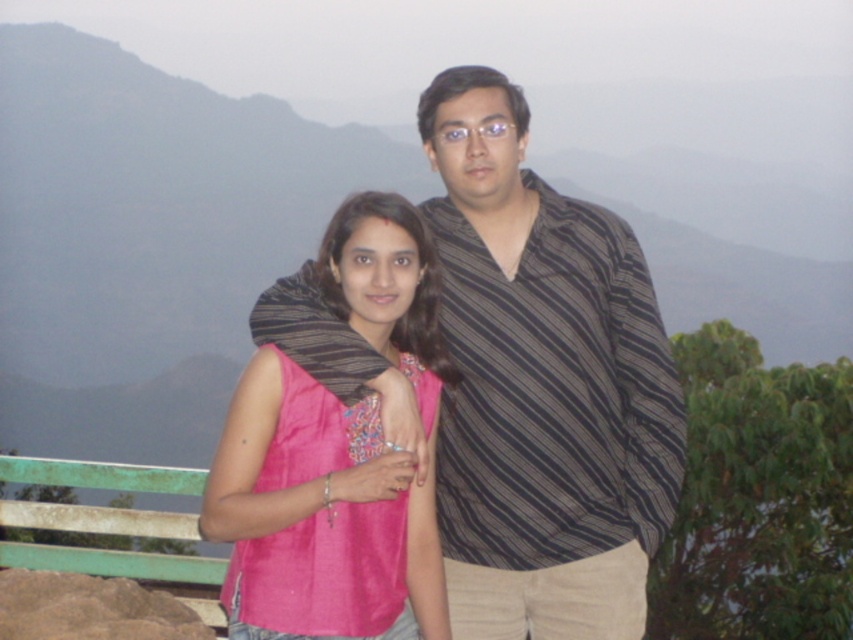
You are a photographer adjusting your camera settings. You notice the striped fabric shirt at center in the image. Where exactly is this shirt positioned in terms of coordinates?

The striped fabric shirt at center is located at point coordinates [543,387].

You are a photographer adjusting your camera settings to focus on two specific points in the image. The points are labeled as point (444, 460) and point (381, 540). Which of these points is closer to the camera?

Point (444, 460) is further to the camera than point (381, 540), so the point closer to the camera is point (381, 540).

Looking at this image, you are a photographer reviewing the image. You need to determine if the striped fabric shirt at center is positioned higher than the pink fabric at center. Based on the scene description, what can you conclude?

The striped fabric shirt at center is above the pink fabric at center, so it is positioned higher.